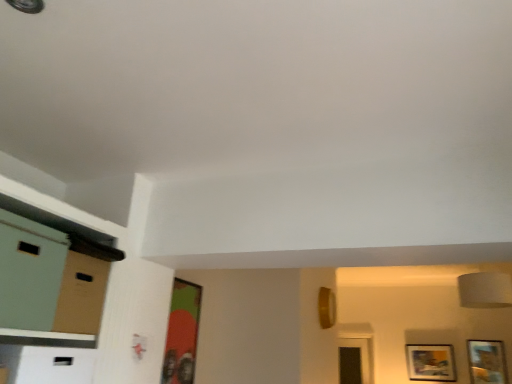
Question: From a real-world perspective, is matte green file cabinet at left located beneath wooden framed picture at lower right, which appears as the second picture frame when viewed from the top?

Choices:
 (A) yes
 (B) no

Answer: (B)

Question: Is matte green file cabinet at left positioned with its back to wooden framed picture at lower right, positioned as the 3th picture frame in left-to-right order?

Choices:
 (A) no
 (B) yes

Answer: (A)

Question: Is matte green file cabinet at left further to the viewer compared to wooden framed picture at lower right, which appears as the second picture frame when viewed from the top?

Choices:
 (A) yes
 (B) no

Answer: (B)

Question: From the image's perspective, is matte green file cabinet at left beneath wooden framed picture at lower right, positioned as the 3th picture frame in left-to-right order?

Choices:
 (A) yes
 (B) no

Answer: (B)

Question: Is matte green file cabinet at left in front of wooden framed picture at lower right, positioned as the 2th picture frame in bottom-to-top order?

Choices:
 (A) no
 (B) yes

Answer: (B)

Question: Is wooden framed picture at lower right, arranged as the 2th picture frame when viewed from the front, inside the boundaries of matte cardboard dresser at left, or outside?

Choices:
 (A) outside
 (B) inside

Answer: (A)

Question: From the image's perspective, relative to matte cardboard dresser at left, is wooden framed picture at lower right, arranged as the 2th picture frame when viewed from the front, above or below?

Choices:
 (A) above
 (B) below

Answer: (B)

Question: Considering the positions of wooden framed picture at lower right, positioned as the 2th picture frame in bottom-to-top order, and matte cardboard dresser at left in the image, is wooden framed picture at lower right, positioned as the 2th picture frame in bottom-to-top order, taller or shorter than matte cardboard dresser at left?

Choices:
 (A) short
 (B) tall

Answer: (B)

Question: Considering their positions, is wooden framed picture at lower right, which appears as the second picture frame when viewed from the top, located in front of or behind matte cardboard dresser at left?

Choices:
 (A) front
 (B) behind

Answer: (B)

Question: Considering their positions, is green matte picture frame at center, marked as the 3th picture frame in a bottom-to-top arrangement, located in front of or behind matte cardboard dresser at left?

Choices:
 (A) behind
 (B) front

Answer: (A)

Question: Considering the positions of green matte picture frame at center, marked as the 3th picture frame in a bottom-to-top arrangement, and matte cardboard dresser at left in the image, is green matte picture frame at center, marked as the 3th picture frame in a bottom-to-top arrangement, bigger or smaller than matte cardboard dresser at left?

Choices:
 (A) small
 (B) big

Answer: (A)

Question: Is green matte picture frame at center, acting as the first picture frame starting from the front, taller or shorter than matte cardboard dresser at left?

Choices:
 (A) short
 (B) tall

Answer: (B)

Question: Choose the correct answer: Is green matte picture frame at center, the third picture frame from the back, inside matte cardboard dresser at left or outside it?

Choices:
 (A) inside
 (B) outside

Answer: (B)

Question: In the image, is green matte picture frame at center, marked as the 1th picture frame in a top-to-bottom arrangement, on the left side or the right side of matte green file cabinet at left?

Choices:
 (A) right
 (B) left

Answer: (A)

Question: Looking at the image, does green matte picture frame at center, marked as the 3th picture frame in a bottom-to-top arrangement, seem bigger or smaller compared to matte green file cabinet at left?

Choices:
 (A) small
 (B) big

Answer: (A)